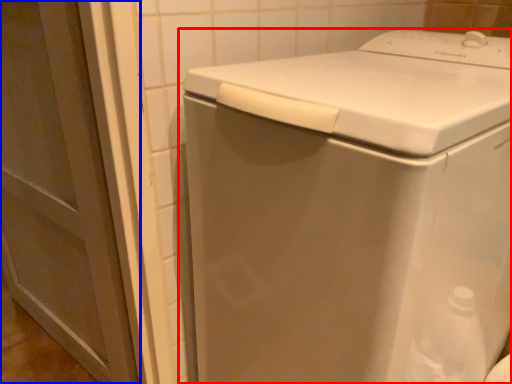
Question: Which of the following is the farthest to the observer, washing machine (highlighted by a red box) or screen door (highlighted by a blue box)?

Choices:
 (A) washing machine
 (B) screen door

Answer: (B)